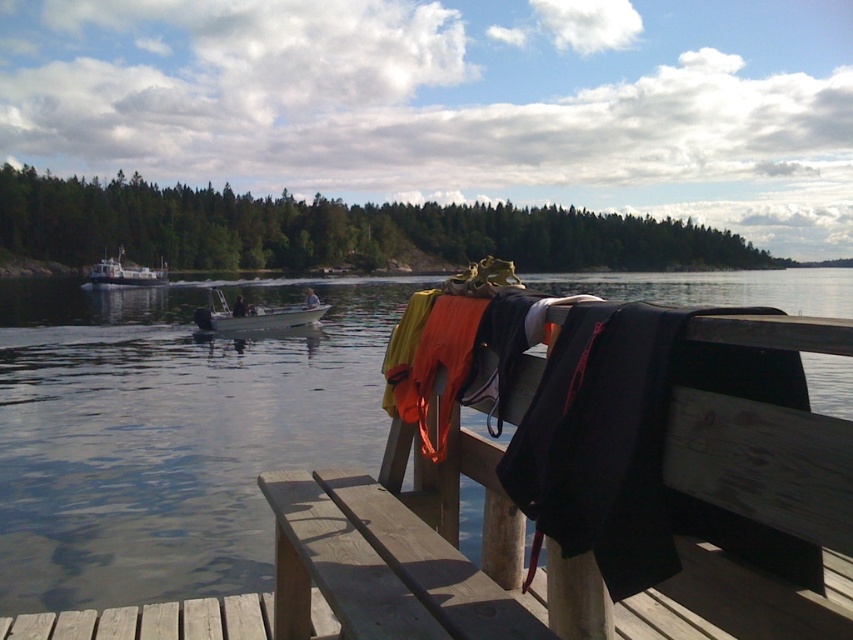
How much distance is there between orange life vest at center and white plastic boat at center?

The distance of orange life vest at center from white plastic boat at center is 67.46 feet.

Who is more forward, (643,348) or (285,308)?

Point (643,348) is more forward.

Where is `orange life vest at center`? orange life vest at center is located at coordinates (640, 444).

Looking at this image, between smooth water at dock center and white plastic boat at left, which one appears on the right side from the viewer's perspective?

Positioned to the right is smooth water at dock center.

Between point (3, 454) and point (85, 284), which one is positioned in front?

Point (3, 454) is more forward.

Measure the distance between smooth water at dock center and camera.

smooth water at dock center is 4.68 feet away from camera.

This screenshot has width=853, height=640. Identify the location of smooth water at dock center. (166, 435).

The image size is (853, 640). Describe the element at coordinates (254, 316) in the screenshot. I see `white plastic boat at center` at that location.

Is white plastic boat at center smaller than white plastic boat at left?

Yes, white plastic boat at center is smaller than white plastic boat at left.

Between point (287, 321) and point (115, 288), which one is positioned in front?

Point (287, 321) is more forward.

Find the location of a particular element. The image size is (853, 640). white plastic boat at center is located at coordinates (254, 316).